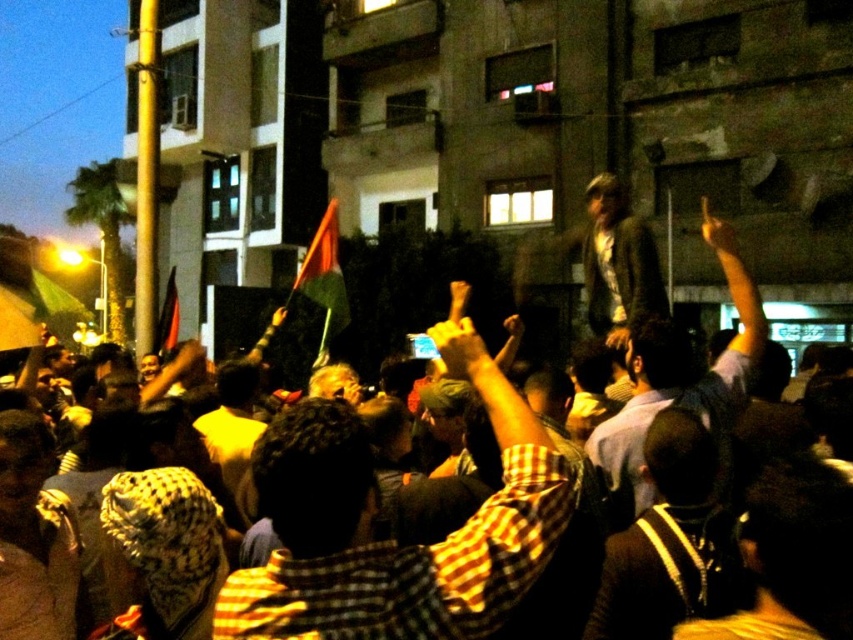
Is dark brown leather jacket at center below greenish-gray textured jacket at center?

Yes.

Which of these two, dark brown leather jacket at center or greenish-gray textured jacket at center, stands taller?

Standing taller between the two is greenish-gray textured jacket at center.

Find the location of `dark brown leather jacket at center`. dark brown leather jacket at center is located at coordinates (670, 541).

Between dark gray jacket at upper center and greenish-gray textured jacket at center, which one appears on the left side from the viewer's perspective?

From the viewer's perspective, greenish-gray textured jacket at center appears more on the left side.

Locate an element on the screen. dark gray jacket at upper center is located at coordinates (682, 374).

Is point (608, 432) farther from viewer compared to point (635, 316)?

No, it is not.

Where is `dark gray jacket at upper center`? dark gray jacket at upper center is located at coordinates (682, 374).

Is checkered shirt at center closer to the viewer compared to dark brown leather jacket at center?

Yes, it is.

Is checkered shirt at center bigger than dark brown leather jacket at center?

Correct, checkered shirt at center is larger in size than dark brown leather jacket at center.

Is point (532, 548) more distant than point (660, 468)?

No, (532, 548) is closer to viewer.

This screenshot has height=640, width=853. I want to click on checkered shirt at center, so click(392, 541).